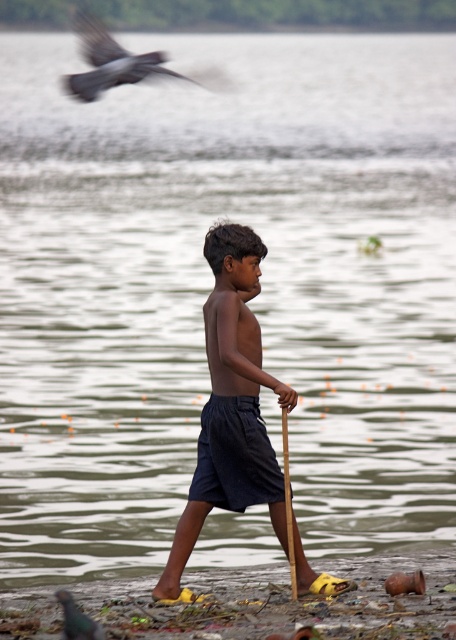
You are a nature photographer observing the scene. You notice the dark gray feathers at upper left and the green glossy bird at lower left. Which object is located higher up in the image?

The dark gray feathers at upper left are positioned over the green glossy bird at lower left, meaning they are higher up in the image.

The boy is walking along the water and needs to put on his yellow rubber sandals at lower center. Which direction should he move to reach them from his dark blue shorts at center?

The yellow rubber sandals at lower center are to the right of the dark blue shorts at center, so the boy should move to his right to reach them.

You are the boy in the image and you want to reach the point that is closer to you. Which point should you walk towards, point (219,499) or point (65,634)?

You should walk towards point (65,634) because it is closer to you than point (219,499).